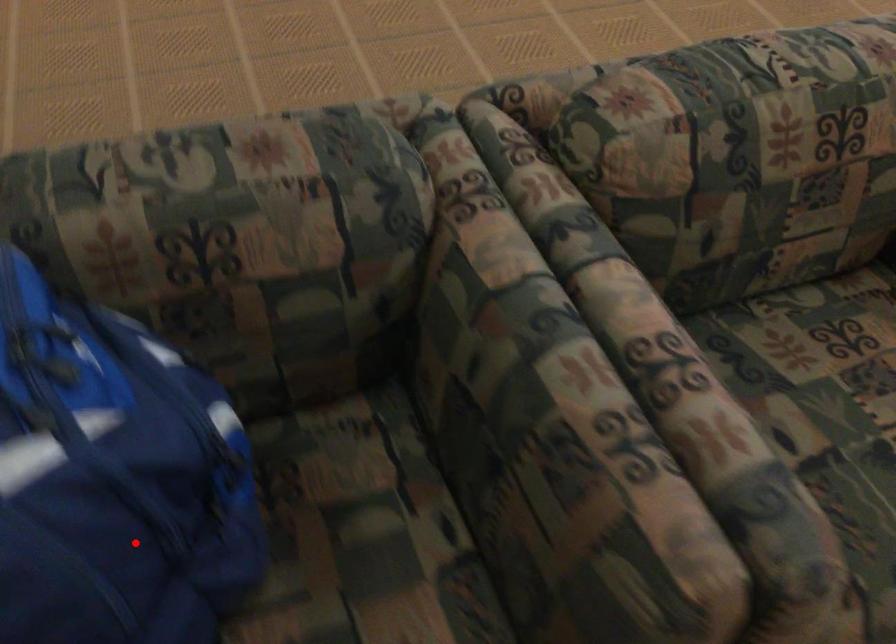
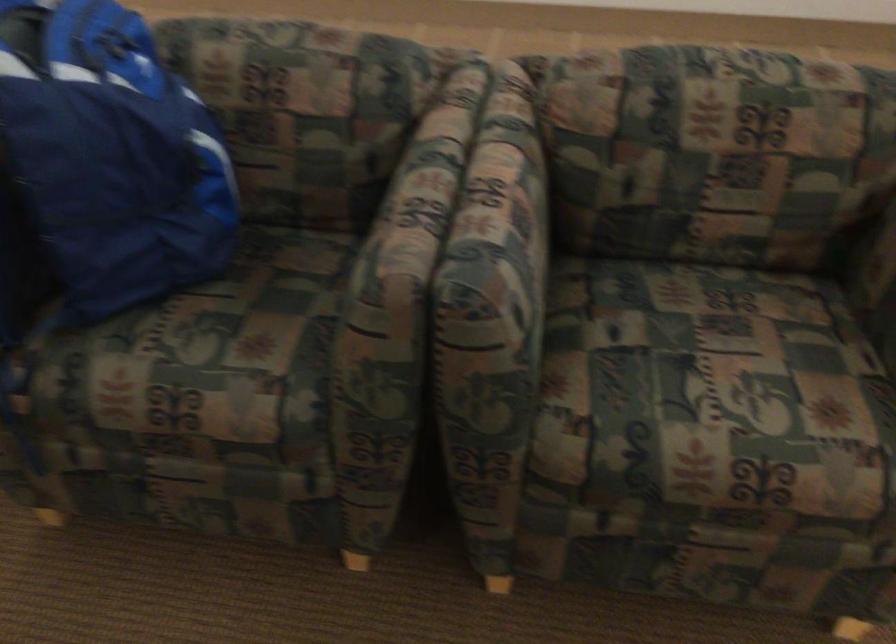
Question: I am providing you with two images of the same scene from different viewpoints. Image1 has a red point marked. In image2, the corresponding 3D location appears at what relative position? Reply with the corresponding letter.

Choices:
 (A) Closer
 (B) Farther

Answer: (B)